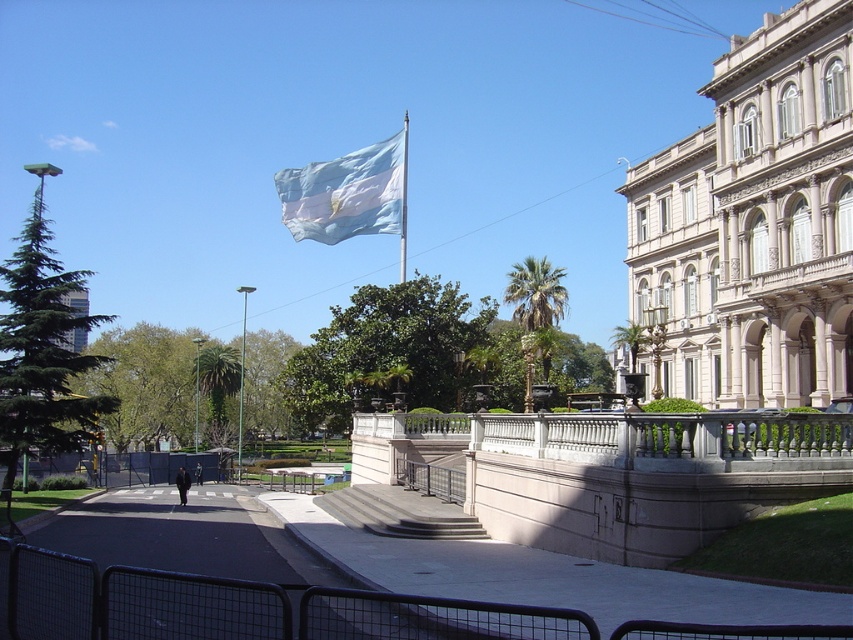
Question: In this image, where is blue fabric flag at upper center located relative to white fabric flag at upper center?

Choices:
 (A) below
 (B) above

Answer: (B)

Question: Is blue fabric flag at upper center further to the viewer compared to white fabric flag at upper center?

Choices:
 (A) no
 (B) yes

Answer: (B)

Question: Among these objects, which one is farthest from the camera?

Choices:
 (A) white fabric flag at upper center
 (B) blue fabric flag at upper center

Answer: (B)

Question: Is blue fabric flag at upper center thinner than white fabric flag at upper center?

Choices:
 (A) yes
 (B) no

Answer: (B)

Question: Which point appears farthest from the camera in this image?

Choices:
 (A) (401, 234)
 (B) (325, 224)

Answer: (B)